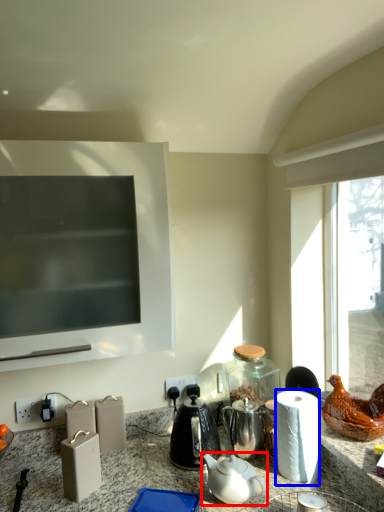
Question: Which object appears closest to the camera in this image, teapot (highlighted by a red box) or paper towel (highlighted by a blue box)?

Choices:
 (A) teapot
 (B) paper towel

Answer: (A)